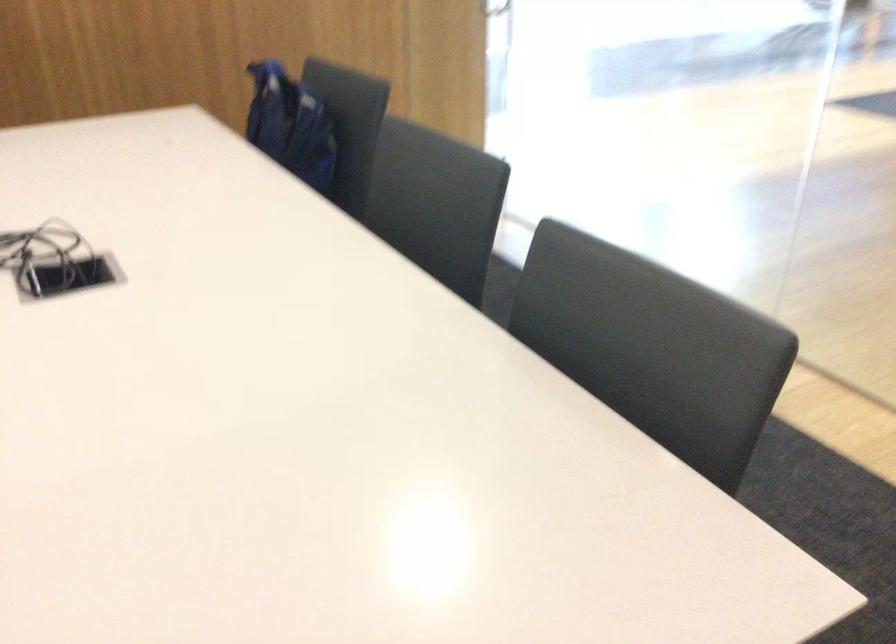
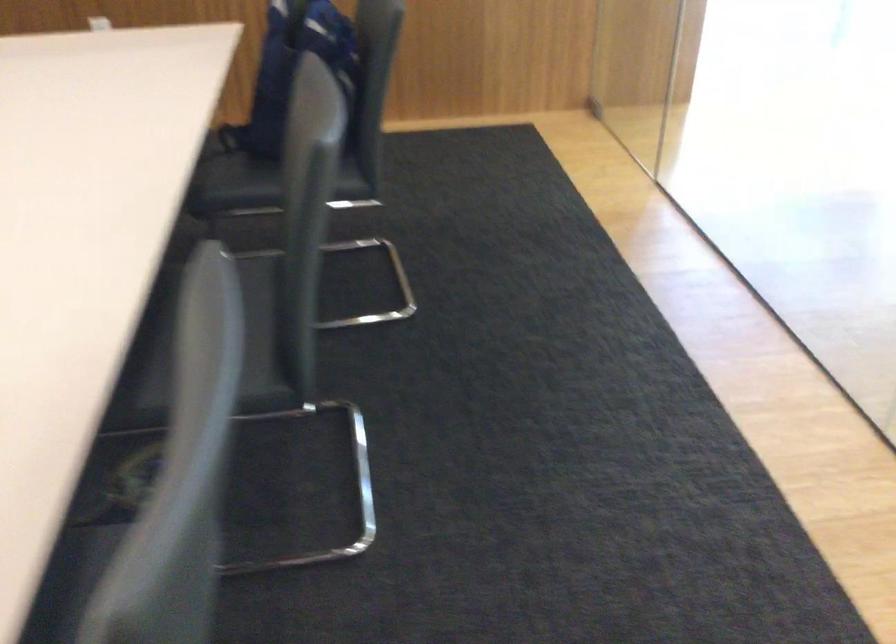
What movement of the cameraman would produce the second image?

The cameraman walked toward right, forward.